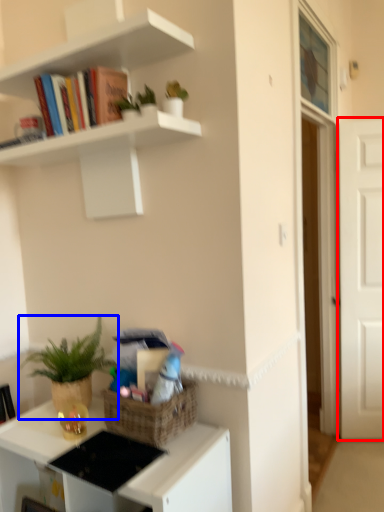
Question: Which object is closer to the camera taking this photo, door (highlighted by a red box) or houseplant (highlighted by a blue box)?

Choices:
 (A) door
 (B) houseplant

Answer: (B)